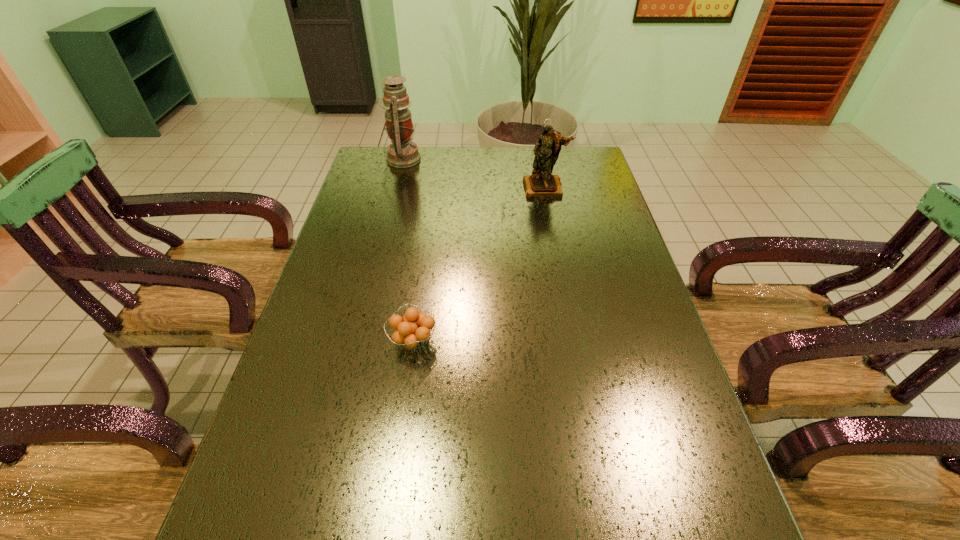
In order to click on oil lamp in this screenshot , I will do `click(402, 153)`.

The width and height of the screenshot is (960, 540). I want to click on the leftmost object, so click(x=402, y=153).

Locate an element on the screen. The image size is (960, 540). the second farthest object is located at coordinates (541, 184).

Find the location of a particular element. The height and width of the screenshot is (540, 960). the second tallest object is located at coordinates (541, 184).

Locate an element on the screen. the nearest object is located at coordinates (412, 330).

Where is `the shortest object`? The image size is (960, 540). the shortest object is located at coordinates [412, 330].

The image size is (960, 540). I want to click on free space located 0.260m on the right of the oil lamp, so click(x=491, y=159).

At what (x,y) coordinates should I click in order to perform the action: click on free location located 0.370m on the front-facing side of the rightmost object. Please return your answer as a coordinate pair (x, y). The width and height of the screenshot is (960, 540). Looking at the image, I should click on (562, 278).

Where is `free space located on the left of the shortest object`? This screenshot has height=540, width=960. free space located on the left of the shortest object is located at coordinates coord(324,341).

Locate an element on the screen. Image resolution: width=960 pixels, height=540 pixels. oil lamp present at the far edge is located at coordinates (402, 153).